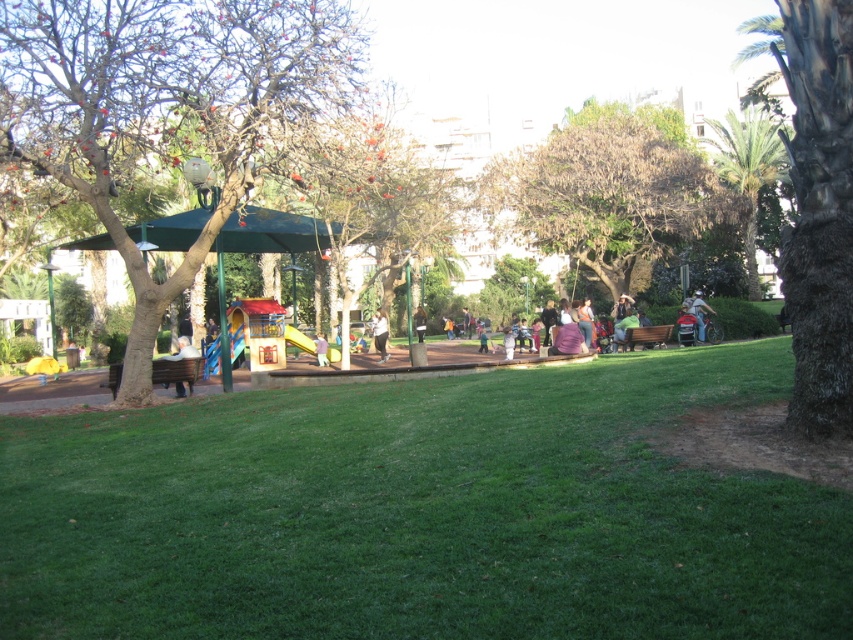
Question: Considering the relative positions of green leafy palm tree at upper right and wooden park bench at lower left in the image provided, where is green leafy palm tree at upper right located with respect to wooden park bench at lower left?

Choices:
 (A) below
 (B) above

Answer: (B)

Question: Does green leafy palm tree at upper right appear on the left side of wooden park bench at lower left?

Choices:
 (A) yes
 (B) no

Answer: (B)

Question: Does green rough bark tree at right appear on the left side of smooth yellow slide at center?

Choices:
 (A) no
 (B) yes

Answer: (A)

Question: Which object appears farthest from the camera in this image?

Choices:
 (A) brown textured tree at upper center
 (B) light brown wooden bench at left
 (C) white matte shirt at center
 (D) wooden park bench at lower left

Answer: (A)

Question: Which object is farther from the camera taking this photo?

Choices:
 (A) brown textured tree at upper center
 (B) brown wooden bench at center

Answer: (A)

Question: Which of the following is the closest to the observer?

Choices:
 (A) (422, 332)
 (B) (215, 45)

Answer: (B)